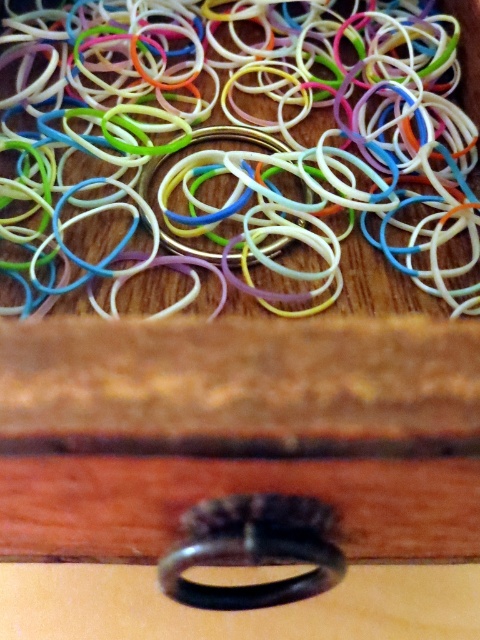
You are holding a small object that is 2 inches thick and want to place it on the wooden surface where the colorful rubber bands are scattered. The point you want to place it at is point [314,205]. Is the distance from you to that point sufficient to avoid knocking over the black ring which is located at a closer distance?

The distance of point [314,205] from viewer is 35.24 inches. Since the black ring is closer than this point, placing the object there would not be an issue as the distance is sufficient to avoid knocking over the black ring.